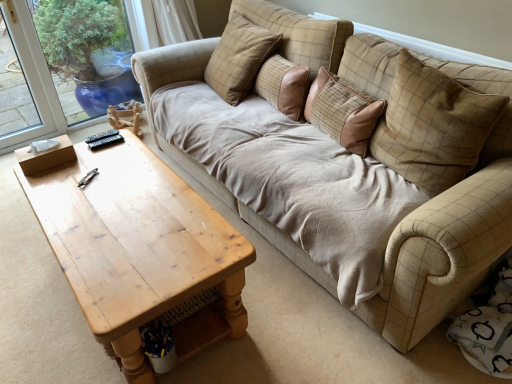
Image resolution: width=512 pixels, height=384 pixels. What do you see at coordinates (433, 126) in the screenshot? I see `plaid fabric pillow at upper right, which is the fourth pillow from left to right` at bounding box center [433, 126].

What is the approximate height of beige fabric couch at center?

3.21 inches.

Locate an element on the screen. Image resolution: width=512 pixels, height=384 pixels. beige checkered pillow at upper center, marked as the fourth pillow in a right-to-left arrangement is located at coordinates (239, 58).

Image resolution: width=512 pixels, height=384 pixels. In order to click on plaid fabric pillow at upper right, which is the fourth pillow from left to right in this screenshot , I will do `click(433, 126)`.

From a real-world perspective, is beige checkered pillow at upper center, marked as the fourth pillow in a right-to-left arrangement, over brown fabric pillow at center, placed as the 2th pillow when sorted from left to right?

Correct, in the physical world, beige checkered pillow at upper center, marked as the fourth pillow in a right-to-left arrangement, is higher than brown fabric pillow at center, placed as the 2th pillow when sorted from left to right.

Is point (260, 65) closer or farther from the camera than point (269, 78)?

Clearly, point (260, 65) is more distant from the camera than point (269, 78).

Is beige checkered pillow at upper center, marked as the fourth pillow in a right-to-left arrangement, wider than brown fabric pillow at center, placed as the 2th pillow when sorted from left to right?

Yes, beige checkered pillow at upper center, marked as the fourth pillow in a right-to-left arrangement, is wider than brown fabric pillow at center, placed as the 2th pillow when sorted from left to right.

Does light brown wooden coffee table at left turn towards brown fabric pillow at center, placed as the 2th pillow when sorted from left to right?

No, light brown wooden coffee table at left is not facing towards brown fabric pillow at center, placed as the 2th pillow when sorted from left to right.

Is brown fabric pillow at center, placed as the 2th pillow when sorted from left to right, surrounded by light brown wooden coffee table at left?

No, light brown wooden coffee table at left does not contain brown fabric pillow at center, placed as the 2th pillow when sorted from left to right.

Is light brown wooden coffee table at left thinner than brown fabric pillow at center, placed as the 2th pillow when sorted from left to right?

No.

Which object is closer to the camera, light brown wooden coffee table at left or brown fabric pillow at center, the third pillow viewed from the right?

light brown wooden coffee table at left is more forward.

Is the position of brown fabric pillow at center, the third pillow viewed from the right, less distant than that of beige fabric couch at center?

No.

Is brown fabric pillow at center, the third pillow viewed from the right, turned away from beige fabric couch at center?

brown fabric pillow at center, the third pillow viewed from the right, does not have its back to beige fabric couch at center.

Are brown fabric pillow at center, the third pillow viewed from the right, and beige fabric couch at center far apart?

No, there isn't a large distance between brown fabric pillow at center, the third pillow viewed from the right, and beige fabric couch at center.

Considering the sizes of brown fabric pillow at center, the third pillow viewed from the right, and beige fabric couch at center in the image, is brown fabric pillow at center, the third pillow viewed from the right, wider or thinner than beige fabric couch at center?

brown fabric pillow at center, the third pillow viewed from the right, is thinner than beige fabric couch at center.

Based on the photo, is beige fabric couch at center to the left of beige checkered pillow at upper center, marked as the fourth pillow in a right-to-left arrangement, from the viewer's perspective?

Yes, beige fabric couch at center is to the left of beige checkered pillow at upper center, marked as the fourth pillow in a right-to-left arrangement.

Is beige checkered pillow at upper center, marked as the fourth pillow in a right-to-left arrangement, at the back of beige fabric couch at center?

beige fabric couch at center does not have its back to beige checkered pillow at upper center, marked as the fourth pillow in a right-to-left arrangement.

Is point (506, 177) more distant than point (240, 43)?

No, (506, 177) is closer to viewer.

From a real-world perspective, is beige fabric couch at center below beige checkered pillow at upper center, which ranks as the first pillow in left-to-right order?

Yes.

Does plaid fabric pillow at upper right, the 1th pillow viewed from the right, turn towards beige fabric couch at center?

No, plaid fabric pillow at upper right, the 1th pillow viewed from the right, does not turn towards beige fabric couch at center.

Would you say plaid fabric pillow at upper right, the 1th pillow viewed from the right, contains beige fabric couch at center?

No, beige fabric couch at center is located outside of plaid fabric pillow at upper right, the 1th pillow viewed from the right.

Considering the relative sizes of plaid fabric pillow at upper right, which is the fourth pillow from left to right, and beige fabric couch at center in the image provided, is plaid fabric pillow at upper right, which is the fourth pillow from left to right, thinner than beige fabric couch at center?

Yes, plaid fabric pillow at upper right, which is the fourth pillow from left to right, is thinner than beige fabric couch at center.

Considering the relative positions of light brown wooden coffee table at left and beige fabric couch at center in the image provided, is light brown wooden coffee table at left behind beige fabric couch at center?

Yes, light brown wooden coffee table at left is further from the viewer.

Which is correct: light brown wooden coffee table at left is inside beige fabric couch at center, or outside of it?

light brown wooden coffee table at left is spatially situated outside beige fabric couch at center.

I want to click on coffee table on the left of beige fabric couch at center, so click(x=140, y=249).

Is light brown wooden coffee table at left oriented away from beige fabric couch at center?

Absolutely, light brown wooden coffee table at left is directed away from beige fabric couch at center.

Is plaid fabric pillow at upper right, which is the fourth pillow from left to right, shorter than brown fabric pillow at center, placed as the 2th pillow when sorted from left to right?

In fact, plaid fabric pillow at upper right, which is the fourth pillow from left to right, may be taller than brown fabric pillow at center, placed as the 2th pillow when sorted from left to right.

From the image's perspective, which is above, plaid fabric pillow at upper right, the 1th pillow viewed from the right, or brown fabric pillow at center, the third pillow viewed from the right?

brown fabric pillow at center, the third pillow viewed from the right.

From the image's perspective, starting from the brown fabric pillow at center, placed as the 2th pillow when sorted from left to right, which pillow is the 2nd one below? Please provide its 2D coordinates.

[(433, 126)]

Which is nearer, (x=392, y=106) or (x=279, y=81)?

The point (x=392, y=106) is closer.

From the image's perspective, starting from the beige checkered pillow at upper center, which ranks as the first pillow in left-to-right order, which pillow is the 1st one below? Please provide its 2D coordinates.

[(283, 85)]

From a real-world perspective, which pillow is the 2nd one above the light brown wooden coffee table at left? Please provide its 2D coordinates.

[(283, 85)]

Based on the photo, when comparing their distances from beige fabric couch at center, does brown fabric pillow at center, the third pillow viewed from the right, or plaid fabric pillow at upper right, which is the fourth pillow from left to right, seem further?

brown fabric pillow at center, the third pillow viewed from the right.

Based on their spatial positions, is beige checkered pillow at upper center, marked as the fourth pillow in a right-to-left arrangement, or beige checkered pillow at upper center, the third pillow viewed from the left, further from brown fabric pillow at center, placed as the 2th pillow when sorted from left to right?

beige checkered pillow at upper center, the third pillow viewed from the left, lies further to brown fabric pillow at center, placed as the 2th pillow when sorted from left to right, than the other object.

Looking at the image, which one is located closer to plaid fabric pillow at upper right, the 1th pillow viewed from the right, light brown wooden coffee table at left or beige fabric couch at center?

beige fabric couch at center.

Which object lies nearer to the anchor point brown fabric pillow at center, placed as the 2th pillow when sorted from left to right, beige checkered pillow at upper center, which is the second pillow in right-to-left order, or beige checkered pillow at upper center, which ranks as the first pillow in left-to-right order?

beige checkered pillow at upper center, which ranks as the first pillow in left-to-right order, lies closer to brown fabric pillow at center, placed as the 2th pillow when sorted from left to right, than the other object.

From the image, which object appears to be farther from brown fabric pillow at center, the third pillow viewed from the right, plaid fabric pillow at upper right, which is the fourth pillow from left to right, or light brown wooden coffee table at left?

light brown wooden coffee table at left.

When comparing their distances from beige checkered pillow at upper center, marked as the fourth pillow in a right-to-left arrangement, does brown fabric pillow at center, placed as the 2th pillow when sorted from left to right, or plaid fabric pillow at upper right, which is the fourth pillow from left to right, seem closer?

Based on the image, brown fabric pillow at center, placed as the 2th pillow when sorted from left to right, appears to be nearer to beige checkered pillow at upper center, marked as the fourth pillow in a right-to-left arrangement.

Based on their spatial positions, is light brown wooden coffee table at left or beige checkered pillow at upper center, marked as the fourth pillow in a right-to-left arrangement, closer to plaid fabric pillow at upper right, the 1th pillow viewed from the right?

light brown wooden coffee table at left is positioned closer to the anchor plaid fabric pillow at upper right, the 1th pillow viewed from the right.

Estimate the real-world distances between objects in this image. Which object is closer to beige checkered pillow at upper center, which ranks as the first pillow in left-to-right order, light brown wooden coffee table at left or beige fabric couch at center?

beige fabric couch at center.

The width and height of the screenshot is (512, 384). I want to click on studio couch between light brown wooden coffee table at left and beige checkered pillow at upper center, the third pillow viewed from the left, from left to right, so click(x=341, y=191).

Identify the location of coffee table positioned between beige fabric couch at center and beige checkered pillow at upper center, which ranks as the first pillow in left-to-right order, from near to far. Image resolution: width=512 pixels, height=384 pixels. pyautogui.click(x=140, y=249).

At what (x,y) coordinates should I click in order to perform the action: click on pillow between plaid fabric pillow at upper right, the 1th pillow viewed from the right, and brown fabric pillow at center, the third pillow viewed from the right, along the z-axis. Please return your answer as a coordinate pair (x, y). The width and height of the screenshot is (512, 384). Looking at the image, I should click on pyautogui.click(x=343, y=112).

This screenshot has height=384, width=512. I want to click on coffee table positioned between beige fabric couch at center and brown fabric pillow at center, placed as the 2th pillow when sorted from left to right, from near to far, so click(x=140, y=249).